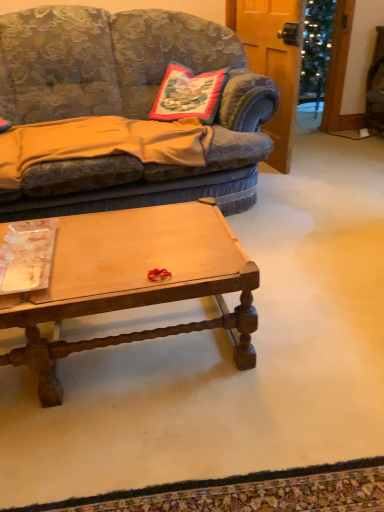
Question: In terms of size, does embroidered fabric pillow at center appear bigger or smaller than velvet fabric couch at center?

Choices:
 (A) small
 (B) big

Answer: (A)

Question: From a real-world perspective, relative to velvet fabric couch at center, is embroidered fabric pillow at center vertically above or below?

Choices:
 (A) below
 (B) above

Answer: (B)

Question: Which is farther from the orange cotton blanket at left?

Choices:
 (A) embroidered fabric pillow at center
 (B) light brown wood coffee table at center
 (C) velvet fabric couch at center

Answer: (B)

Question: Which of these objects is positioned closest to the velvet fabric couch at center?

Choices:
 (A) embroidered fabric pillow at center
 (B) light brown wood coffee table at center
 (C) orange cotton blanket at left

Answer: (C)